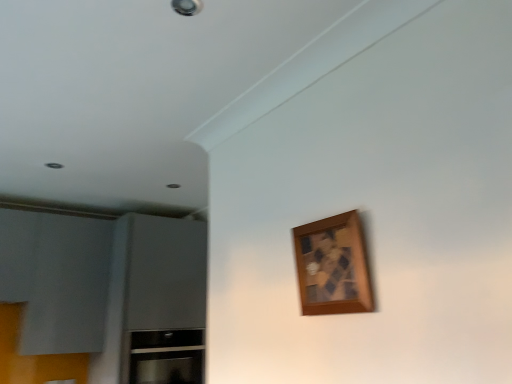
Where is `satin silver cabinet at lower left`? This screenshot has width=512, height=384. satin silver cabinet at lower left is located at coordinates (164, 357).

Describe the element at coordinates (164, 357) in the screenshot. I see `satin silver cabinet at lower left` at that location.

Image resolution: width=512 pixels, height=384 pixels. I want to click on wooden picture frame at upper right, so click(333, 266).

This screenshot has width=512, height=384. What do you see at coordinates (333, 266) in the screenshot?
I see `wooden picture frame at upper right` at bounding box center [333, 266].

Locate an element on the screen. The image size is (512, 384). satin silver cabinet at lower left is located at coordinates (164, 357).

Which is more to the left, wooden picture frame at upper right or satin silver cabinet at lower left?

Positioned to the left is satin silver cabinet at lower left.

Considering the relative positions of wooden picture frame at upper right and satin silver cabinet at lower left in the image provided, is wooden picture frame at upper right behind satin silver cabinet at lower left?

No, wooden picture frame at upper right is closer to the camera.

Looking at this image, which point is more forward, (323, 293) or (144, 343)?

The point (323, 293) is closer to the camera.

From the image's perspective, would you say wooden picture frame at upper right is shown under satin silver cabinet at lower left?

No.

From a real-world perspective, does wooden picture frame at upper right sit lower than satin silver cabinet at lower left?

No, from a real-world perspective, wooden picture frame at upper right is not beneath satin silver cabinet at lower left.

Between wooden picture frame at upper right and satin silver cabinet at lower left, which one has smaller width?

wooden picture frame at upper right is thinner.

From the picture: Which of these two, wooden picture frame at upper right or satin silver cabinet at lower left, stands taller?

With more height is satin silver cabinet at lower left.

Looking at the image, does wooden picture frame at upper right seem bigger or smaller compared to satin silver cabinet at lower left?

In the image, wooden picture frame at upper right appears to be smaller than satin silver cabinet at lower left.

Is wooden picture frame at upper right not inside satin silver cabinet at lower left?

Yes.

Is wooden picture frame at upper right far from satin silver cabinet at lower left?

wooden picture frame at upper right is positioned a significant distance from satin silver cabinet at lower left.

From the picture: Is wooden picture frame at upper right facing towards satin silver cabinet at lower left?

No, wooden picture frame at upper right is not oriented towards satin silver cabinet at lower left.

What's the angular difference between wooden picture frame at upper right and satin silver cabinet at lower left's facing directions?

wooden picture frame at upper right and satin silver cabinet at lower left are facing 90 degrees away from each other.

Where is `picture frame in front of the satin silver cabinet at lower left`? Image resolution: width=512 pixels, height=384 pixels. picture frame in front of the satin silver cabinet at lower left is located at coordinates (333, 266).

Considering the relative positions of satin silver cabinet at lower left and wooden picture frame at upper right in the image provided, is satin silver cabinet at lower left to the right of wooden picture frame at upper right from the viewer's perspective?

No, satin silver cabinet at lower left is not to the right of wooden picture frame at upper right.

Is satin silver cabinet at lower left closer to the viewer compared to wooden picture frame at upper right?

No, satin silver cabinet at lower left is behind wooden picture frame at upper right.

Considering the points (190, 358) and (366, 290), which point is in front, point (190, 358) or point (366, 290)?

Positioned in front is point (366, 290).

From the image's perspective, does satin silver cabinet at lower left appear lower than wooden picture frame at upper right?

Yes, from the image's perspective, satin silver cabinet at lower left is beneath wooden picture frame at upper right.

From a real-world perspective, is satin silver cabinet at lower left over wooden picture frame at upper right?

Incorrect, from a real-world perspective, satin silver cabinet at lower left is lower than wooden picture frame at upper right.

Between satin silver cabinet at lower left and wooden picture frame at upper right, which one has smaller width?

wooden picture frame at upper right is thinner.

Is satin silver cabinet at lower left taller or shorter than wooden picture frame at upper right?

satin silver cabinet at lower left is taller than wooden picture frame at upper right.

Consider the image. Considering the sizes of satin silver cabinet at lower left and wooden picture frame at upper right in the image, is satin silver cabinet at lower left bigger or smaller than wooden picture frame at upper right?

In the image, satin silver cabinet at lower left appears to be larger than wooden picture frame at upper right.

Choose the correct answer: Is satin silver cabinet at lower left inside wooden picture frame at upper right or outside it?

satin silver cabinet at lower left is located beyond the bounds of wooden picture frame at upper right.

Is satin silver cabinet at lower left not near wooden picture frame at upper right?

Absolutely, satin silver cabinet at lower left is distant from wooden picture frame at upper right.

Could you tell me if satin silver cabinet at lower left is facing wooden picture frame at upper right?

Yes, satin silver cabinet at lower left is turned towards wooden picture frame at upper right.

How many degrees apart are the facing directions of satin silver cabinet at lower left and wooden picture frame at upper right?

The angle between the facing direction of satin silver cabinet at lower left and the facing direction of wooden picture frame at upper right is 90 degrees.

Locate an element on the screen. This screenshot has width=512, height=384. cabinetry that appears on the left of wooden picture frame at upper right is located at coordinates (164, 357).

I want to click on picture frame above the satin silver cabinet at lower left (from the image's perspective), so click(333, 266).

Find the location of a particular element. The width and height of the screenshot is (512, 384). picture frame that appears above the satin silver cabinet at lower left (from a real-world perspective) is located at coordinates (333, 266).